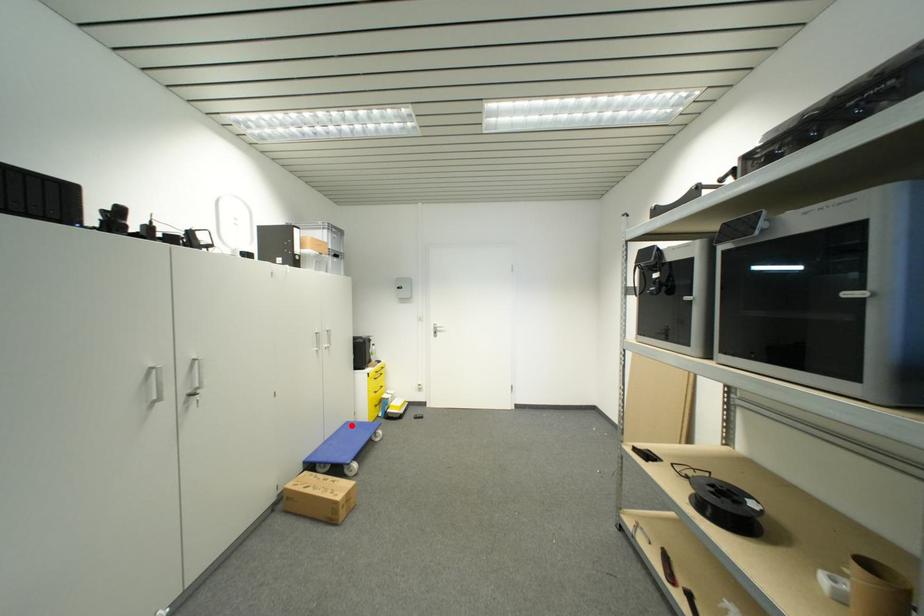
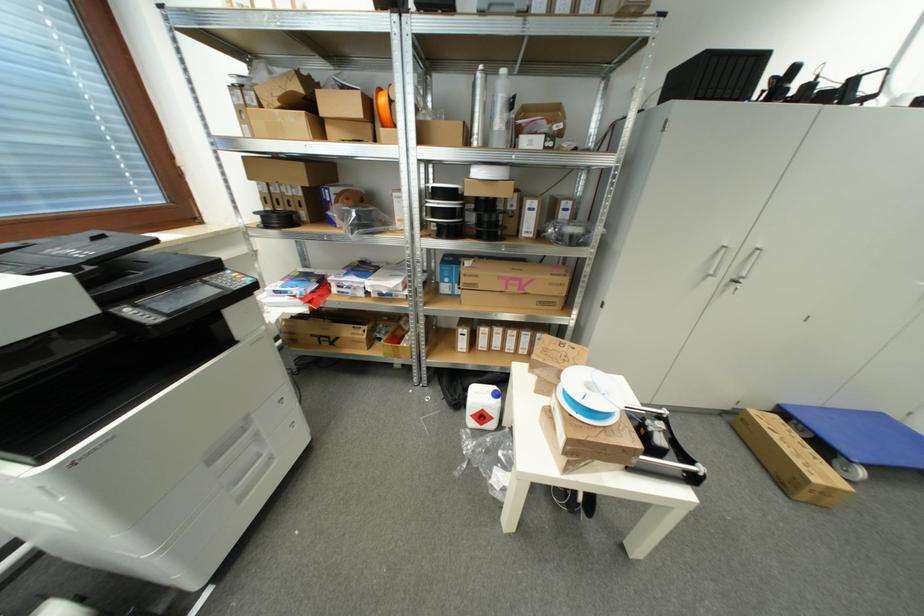
Question: A red point is marked in image1. In image2, is the corresponding 3D point closer to the camera or farther? Reply with the corresponding letter.

Choices:
 (A) The corresponding 3D point is closer.
 (B) The corresponding 3D point is farther.

Answer: (A)